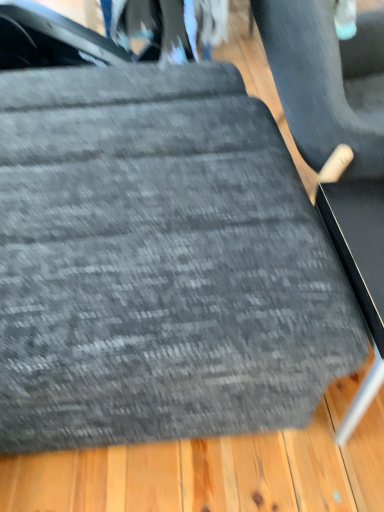
Where is `textured gray cushion at center`? This screenshot has height=512, width=384. textured gray cushion at center is located at coordinates (338, 143).

This screenshot has height=512, width=384. Describe the element at coordinates (338, 143) in the screenshot. I see `textured gray cushion at center` at that location.

Measure the distance between point (372, 304) and camera.

A distance of 30.83 inches exists between point (372, 304) and camera.

The image size is (384, 512). Identify the location of textured gray cushion at center. (338, 143).